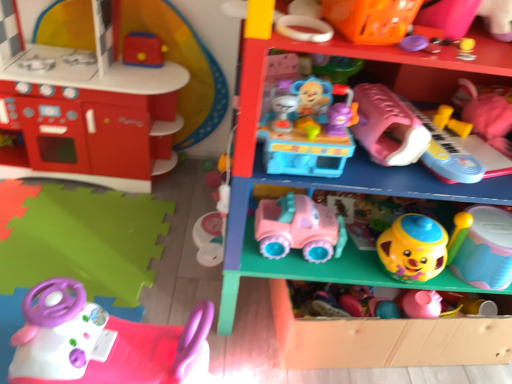
This screenshot has height=384, width=512. Find the location of `vacant space that's between pink plastic toy car at center, placed as the 1th shelf when sorted from top to bottom, and matte pink car at lower center, placed as the 1th shelf when sorted from bottom to top`. vacant space that's between pink plastic toy car at center, placed as the 1th shelf when sorted from top to bottom, and matte pink car at lower center, placed as the 1th shelf when sorted from bottom to top is located at coordinates 253,352.